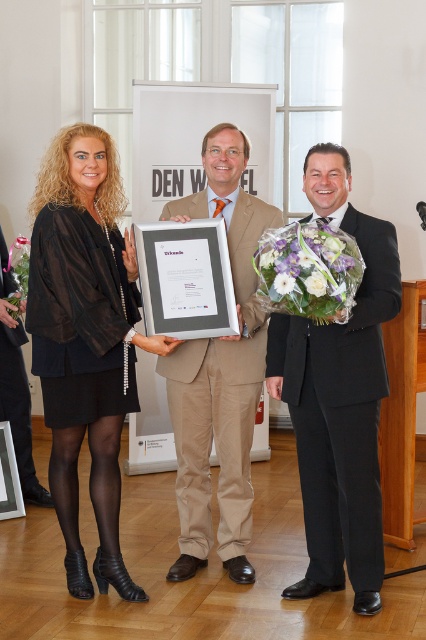
Question: Which point is farther to the camera?

Choices:
 (A) (242, 452)
 (B) (325, 272)
 (C) (291, 289)
 (D) (317, 269)

Answer: (A)

Question: Which point is farther to the camera?

Choices:
 (A) (115, 292)
 (B) (276, 353)
 (C) (313, 275)

Answer: (B)

Question: Among these objects, which one is nearest to the camera?

Choices:
 (A) matte silver frame at center
 (B) white matte flower at center

Answer: (B)

Question: Can you confirm if white matte flower at center is positioned above white silk flower at center?

Choices:
 (A) yes
 (B) no

Answer: (B)

Question: Can you confirm if black suit at center is wider than white silk flower at center?

Choices:
 (A) no
 (B) yes

Answer: (B)

Question: Does black suit at center come behind white floral bouquet at center?

Choices:
 (A) yes
 (B) no

Answer: (A)